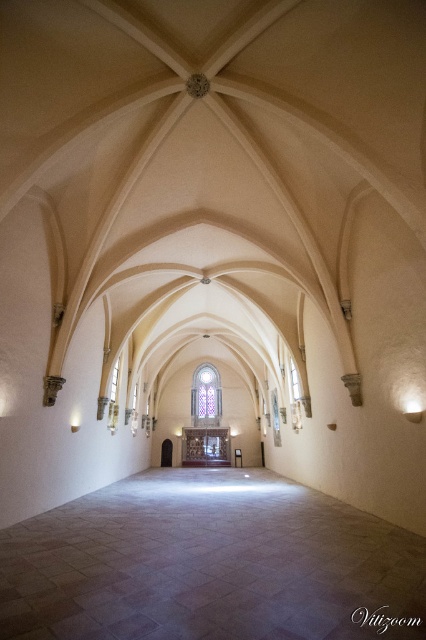
Consider the image. You are an architect visiting the cathedral and notice two windows at the far end of the nave. The first is labeled as the stained glass window at center, and the second is the transparent glass window at center. Which of these two windows is wider?

The stained glass window at center is wider than the transparent glass window at center, as its width surpasses the latter.